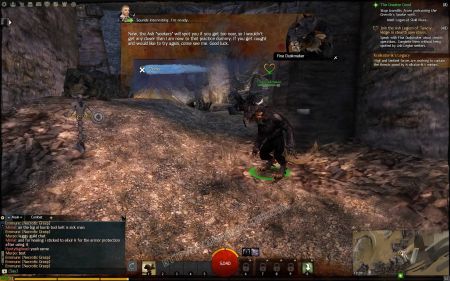
Identify the location of message board. Image resolution: width=450 pixels, height=281 pixels. (50, 236).